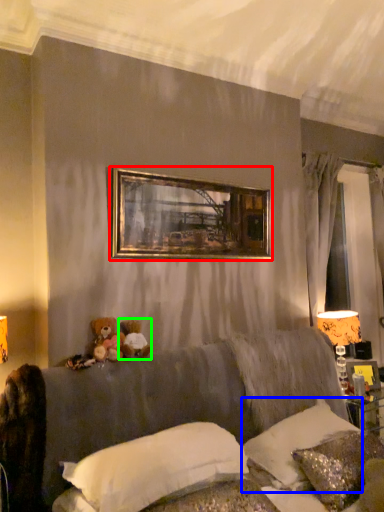
Question: Estimate the real-world distances between objects in this image. Which object is farther from picture frame (highlighted by a red box), pillow (highlighted by a blue box) or toy (highlighted by a green box)?

Choices:
 (A) pillow
 (B) toy

Answer: (A)